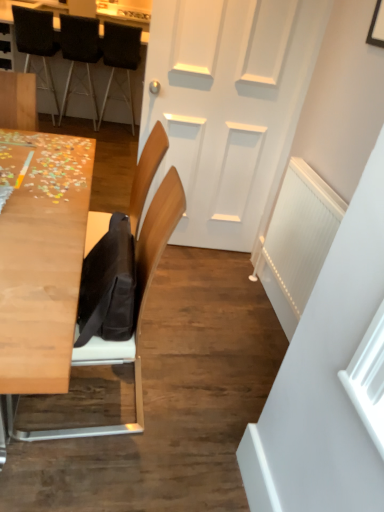
What are the coordinates of `vacant area on top of light wood table at left, the 1th table when ordered from front to back (from a real-world perspective)` in the screenshot? It's located at (54, 193).